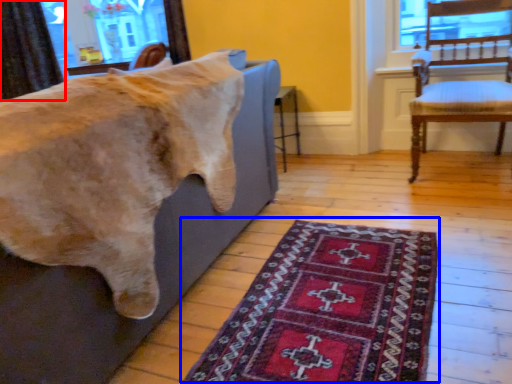
Question: Among these objects, which one is farthest to the camera, curtain (highlighted by a red box) or mat (highlighted by a blue box)?

Choices:
 (A) curtain
 (B) mat

Answer: (A)